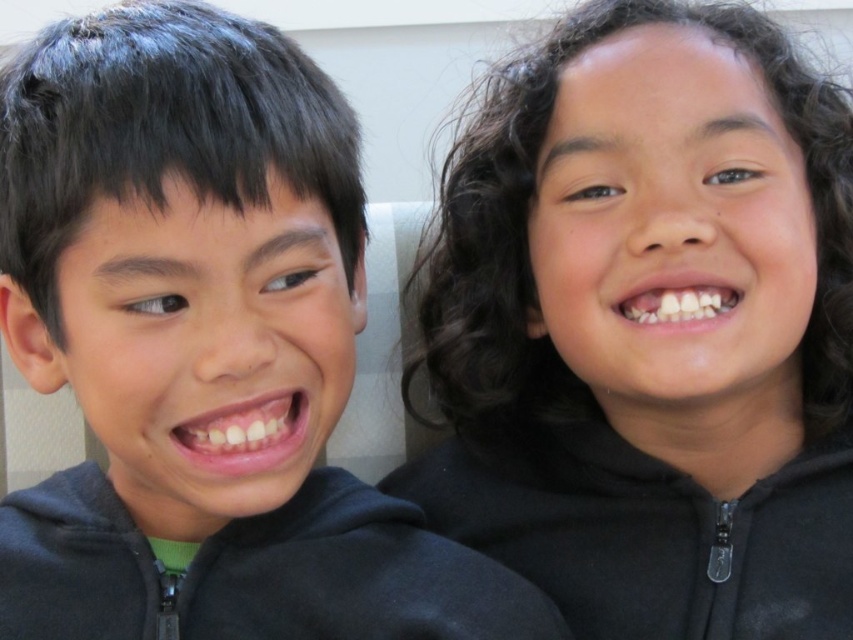
Question: Which object is farther from the camera taking this photo?

Choices:
 (A) black fleece sweatshirt at right
 (B) black zip-up sweatshirt at lower left
 (C) black matte hair at upper right
 (D) black matte hoodie at left

Answer: (A)

Question: Is black matte hair at upper right to the right of black fleece sweatshirt at right from the viewer's perspective?

Choices:
 (A) yes
 (B) no

Answer: (B)

Question: Which object is the closest to the black matte hair at upper right?

Choices:
 (A) black matte hoodie at left
 (B) black fleece sweatshirt at right
 (C) black zip-up sweatshirt at lower left

Answer: (B)

Question: Can you confirm if black matte hair at upper right is bigger than black zip-up sweatshirt at lower left?

Choices:
 (A) yes
 (B) no

Answer: (A)

Question: Which object appears farthest from the camera in this image?

Choices:
 (A) black zip-up sweatshirt at lower left
 (B) black matte hair at upper right
 (C) black matte hoodie at left
 (D) black fleece sweatshirt at right

Answer: (D)

Question: Does black matte hoodie at left have a smaller size compared to black zip-up sweatshirt at lower left?

Choices:
 (A) no
 (B) yes

Answer: (A)